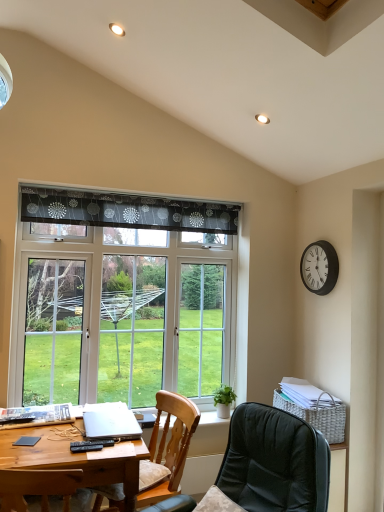
Where is `leather-like black chair at lower center, placed as the 2th chair when sorted from back to front`? leather-like black chair at lower center, placed as the 2th chair when sorted from back to front is located at coordinates (274, 462).

What do you see at coordinates (319, 267) in the screenshot?
I see `black metal clock at upper right` at bounding box center [319, 267].

The width and height of the screenshot is (384, 512). What do you see at coordinates (122, 298) in the screenshot?
I see `transparent glass window at center` at bounding box center [122, 298].

The image size is (384, 512). Describe the element at coordinates (90, 445) in the screenshot. I see `black plastic remote control at lower left, placed as the first remote control when sorted from right to left` at that location.

Locate an element on the screen. leather-like black chair at lower center, the first chair positioned from the front is located at coordinates (274, 462).

Between silver metallic laptop at lower left and white wicker picnic basket at lower right, which one has larger width?

Wider between the two is silver metallic laptop at lower left.

Based on the photo, is silver metallic laptop at lower left bigger than white wicker picnic basket at lower right?

Actually, silver metallic laptop at lower left might be smaller than white wicker picnic basket at lower right.

Is silver metallic laptop at lower left next to white wicker picnic basket at lower right and touching it?

No, silver metallic laptop at lower left is not touching white wicker picnic basket at lower right.

Is silver metallic laptop at lower left oriented away from white wicker picnic basket at lower right?

silver metallic laptop at lower left does not have its back to white wicker picnic basket at lower right.

In terms of width, does leather-like black chair at lower center, the first chair positioned from the front, look wider or thinner when compared to transparent glass window at center?

Considering their sizes, leather-like black chair at lower center, the first chair positioned from the front, looks broader than transparent glass window at center.

At what (x,y) coordinates should I click in order to perform the action: click on the 1st chair directly beneath the transparent glass window at center (from a real-world perspective). Please return your answer as a coordinate pair (x, y). The width and height of the screenshot is (384, 512). Looking at the image, I should click on (274, 462).

Consider the image. Is leather-like black chair at lower center, placed as the 2th chair when sorted from back to front, taller or shorter than transparent glass window at center?

leather-like black chair at lower center, placed as the 2th chair when sorted from back to front, is shorter than transparent glass window at center.

Between leather-like black chair at lower center, placed as the 2th chair when sorted from back to front, and transparent glass window at center, which one has larger size?

leather-like black chair at lower center, placed as the 2th chair when sorted from back to front, is bigger.

Is wooden desk at lower left positioned in front of transparent glass window at center?

Yes, the depth of wooden desk at lower left is less than that of transparent glass window at center.

Can transparent glass window at center be found inside wooden desk at lower left?

No, transparent glass window at center is located outside of wooden desk at lower left.

Consider the image. Is wooden desk at lower left to the left of transparent glass window at center from the viewer's perspective?

Correct, you'll find wooden desk at lower left to the left of transparent glass window at center.

Which point is more forward, (69,449) or (168,292)?

Positioned in front is point (69,449).

Which is more distant, [130,309] or [311,475]?

Point [130,309]

Is the surface of transparent glass window at center in direct contact with leather-like black chair at lower center, placed as the 2th chair when sorted from back to front?

transparent glass window at center is not next to leather-like black chair at lower center, placed as the 2th chair when sorted from back to front, and they're not touching.

Considering the sizes of transparent glass window at center and leather-like black chair at lower center, the first chair positioned from the front, in the image, is transparent glass window at center wider or thinner than leather-like black chair at lower center, the first chair positioned from the front,?

Clearly, transparent glass window at center has less width compared to leather-like black chair at lower center, the first chair positioned from the front.

How much distance is there between transparent glass window at center and leather-like black chair at lower center, the first chair positioned from the front?

4.17 feet.

Between white wicker picnic basket at lower right and leather-like black chair at lower center, the first chair positioned from the front, which one has smaller size?

With smaller size is white wicker picnic basket at lower right.

Which is behind, point (291, 403) or point (289, 510)?

The point (291, 403) is farther from the camera.

Between white wicker picnic basket at lower right and leather-like black chair at lower center, the first chair positioned from the front, which one appears on the right side from the viewer's perspective?

white wicker picnic basket at lower right.

Measure the distance from white wicker picnic basket at lower right to leather-like black chair at lower center, the first chair positioned from the front.

white wicker picnic basket at lower right is 71.99 centimeters away from leather-like black chair at lower center, the first chair positioned from the front.

Between point (32, 415) and point (83, 442), which one is positioned behind?

The point (32, 415) is behind.

From the image's perspective, which is below, black plastic remote control at lower left, which is the 1th remote control from back to front, or black plastic remote control at lower left, arranged as the second remote control when viewed from the back?

From the image's view, black plastic remote control at lower left, arranged as the second remote control when viewed from the back, is below.

Visually, is black plastic remote control at lower left, the second remote control in the front-to-back sequence, positioned to the left or to the right of black plastic remote control at lower left, arranged as the second remote control when viewed from the back?

Clearly, black plastic remote control at lower left, the second remote control in the front-to-back sequence, is on the left of black plastic remote control at lower left, arranged as the second remote control when viewed from the back, in the image.

Is black plastic remote control at lower left, the second remote control in the front-to-back sequence, positioned in front of black plastic remote control at lower left, the first remote control from the front?

No, black plastic remote control at lower left, the second remote control in the front-to-back sequence, is further to the viewer.

In the image, is black metal clock at upper right positioned in front of or behind black plastic remote control at lower left, arranged as the 1th remote control when viewed from the left?

black metal clock at upper right is positioned farther from the viewer than black plastic remote control at lower left, arranged as the 1th remote control when viewed from the left.

Is black metal clock at upper right oriented away from black plastic remote control at lower left, arranged as the 1th remote control when viewed from the left?

black metal clock at upper right is not turned away from black plastic remote control at lower left, arranged as the 1th remote control when viewed from the left.

Does point (319, 257) come farther from viewer compared to point (34, 418)?

Yes, point (319, 257) is farther from viewer.

Locate an element on the screen. The height and width of the screenshot is (512, 384). picnic basket located behind the silver metallic laptop at lower left is located at coordinates (317, 417).

From the transparent glass window at center, count 2nd chairs forward and point to it. Please provide its 2D coordinates.

[(274, 462)]

Estimate the real-world distances between objects in this image. Which object is further from wooden desk at lower left, white wicker picnic basket at lower right or leather-like black chair at lower center, placed as the 2th chair when sorted from back to front?

white wicker picnic basket at lower right.

Looking at the image, which one is located closer to silver metallic laptop at lower left, black plastic remote control at lower left, which is the 2th remote control from left to right, or wooden desk at lower left?

black plastic remote control at lower left, which is the 2th remote control from left to right.

Which object lies nearer to the anchor point silver metallic laptop at lower left, white wicker picnic basket at lower right or black metal clock at upper right?

white wicker picnic basket at lower right is closer to silver metallic laptop at lower left.

Considering their positions, is wooden desk at lower left positioned further to black plastic remote control at lower left, the first remote control from the front, than transparent glass window at center?

transparent glass window at center lies further to black plastic remote control at lower left, the first remote control from the front, than the other object.

Looking at the image, which one is located further to wooden chair at lower left, the 2th chair from the front, wooden desk at lower left or transparent glass window at center?

transparent glass window at center is positioned further to the anchor wooden chair at lower left, the 2th chair from the front.

When comparing their distances from black plastic remote control at lower left, the second remote control viewed from the right, does transparent glass window at center or wooden chair at lower left, the 2th chair from the front, seem further?

Based on the image, transparent glass window at center appears to be further to black plastic remote control at lower left, the second remote control viewed from the right.

Looking at the image, which one is located closer to black plastic remote control at lower left, which is the 1th remote control from back to front, leather-like black chair at lower center, the first chair positioned from the front, or black metal clock at upper right?

Based on the image, leather-like black chair at lower center, the first chair positioned from the front, appears to be nearer to black plastic remote control at lower left, which is the 1th remote control from back to front.

When comparing their distances from white wicker picnic basket at lower right, does leather-like black chair at lower center, the first chair positioned from the front, or wooden desk at lower left seem further?

Based on the image, wooden desk at lower left appears to be further to white wicker picnic basket at lower right.

Find the location of `window between black plastic remote control at lower left, arranged as the second remote control when viewed from the back, and black metal clock at upper right from left to right`. window between black plastic remote control at lower left, arranged as the second remote control when viewed from the back, and black metal clock at upper right from left to right is located at coordinates (122, 298).

Where is `window located between black plastic remote control at lower left, arranged as the 1th remote control when viewed from the left, and white wicker picnic basket at lower right in the left-right direction`? window located between black plastic remote control at lower left, arranged as the 1th remote control when viewed from the left, and white wicker picnic basket at lower right in the left-right direction is located at coordinates (122, 298).

The height and width of the screenshot is (512, 384). I want to click on remote control between black plastic remote control at lower left, the second remote control in the front-to-back sequence, and silver metallic laptop at lower left from left to right, so click(x=90, y=445).

Identify the location of remote control between silver metallic laptop at lower left and wooden chair at lower left, the 1th chair when ordered from back to front, from top to bottom. The image size is (384, 512). (90, 445).